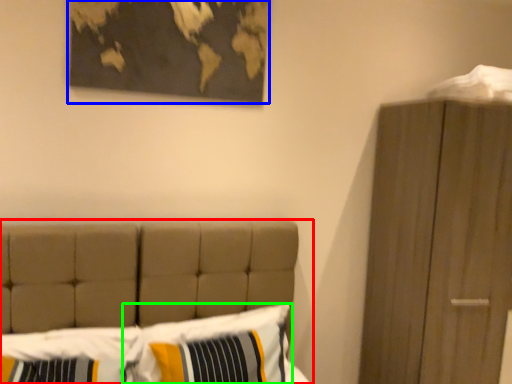
Question: Which object is positioned farthest from bed (highlighted by a red box)? Select from picture frame (highlighted by a blue box) and pillow (highlighted by a green box).

Choices:
 (A) picture frame
 (B) pillow

Answer: (A)